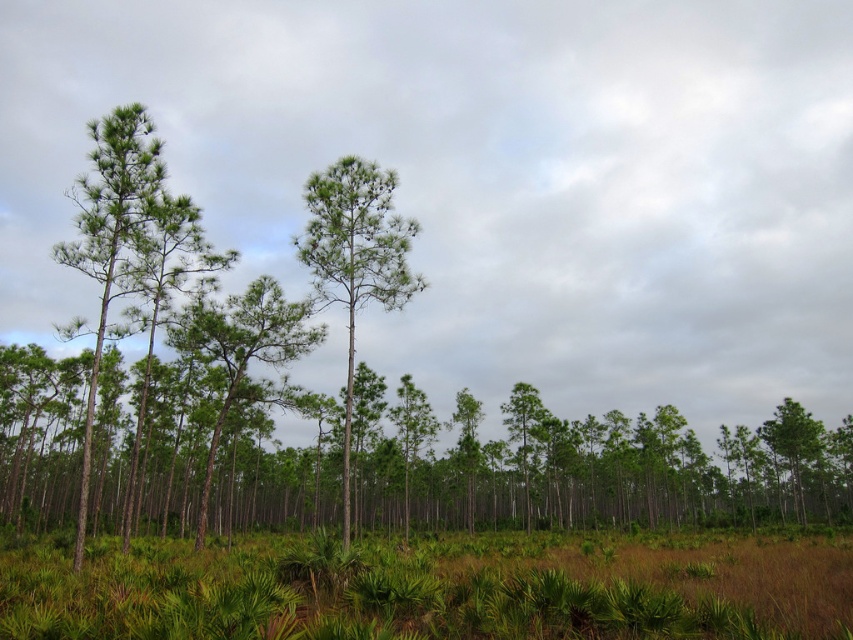
You are a hiker trying to walk through the forest. You notice the green leafy grass at lower center and the green matte tree at center. Which one is shorter?

The green leafy grass at lower center is shorter than the green matte tree at center.

You are standing in the forest depicted in the scene. You notice a point marked at coordinates (x=434, y=588). What object or feature is located at that specific coordinate?

The point at coordinates (x=434, y=588) corresponds to green leafy grass at lower center.